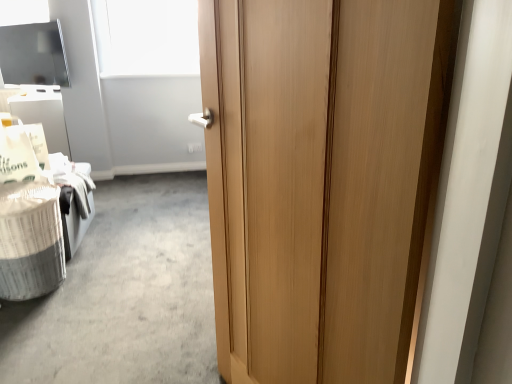
Question: Would you say white textured laundry basket at lower left is outside white matte window screen at upper center?

Choices:
 (A) no
 (B) yes

Answer: (B)

Question: Does white textured laundry basket at lower left have a larger size compared to white matte window screen at upper center?

Choices:
 (A) no
 (B) yes

Answer: (B)

Question: Is white textured laundry basket at lower left next to white matte window screen at upper center and touching it?

Choices:
 (A) no
 (B) yes

Answer: (A)

Question: From the image's perspective, is white textured laundry basket at lower left beneath white matte window screen at upper center?

Choices:
 (A) yes
 (B) no

Answer: (A)

Question: Is white textured laundry basket at lower left shorter than white matte window screen at upper center?

Choices:
 (A) yes
 (B) no

Answer: (A)

Question: Is white textured laundry basket at lower left not close to white matte window screen at upper center?

Choices:
 (A) no
 (B) yes

Answer: (B)

Question: Considering the relative sizes of white matte window screen at upper center and white textured laundry basket at lower left in the image provided, is white matte window screen at upper center thinner than white textured laundry basket at lower left?

Choices:
 (A) no
 (B) yes

Answer: (B)

Question: From the image's perspective, is white matte window screen at upper center located above white textured laundry basket at lower left?

Choices:
 (A) no
 (B) yes

Answer: (B)

Question: Is white matte window screen at upper center bigger than white textured laundry basket at lower left?

Choices:
 (A) yes
 (B) no

Answer: (B)

Question: Is white matte window screen at upper center further to the viewer compared to white textured laundry basket at lower left?

Choices:
 (A) no
 (B) yes

Answer: (B)

Question: Can you confirm if white matte window screen at upper center is smaller than white textured laundry basket at lower left?

Choices:
 (A) no
 (B) yes

Answer: (B)

Question: Is white textured laundry basket at lower left at the back of white matte window screen at upper center?

Choices:
 (A) no
 (B) yes

Answer: (A)

Question: Considering the relative sizes of wooden door at center and white matte window screen at upper center in the image provided, is wooden door at center smaller than white matte window screen at upper center?

Choices:
 (A) no
 (B) yes

Answer: (A)